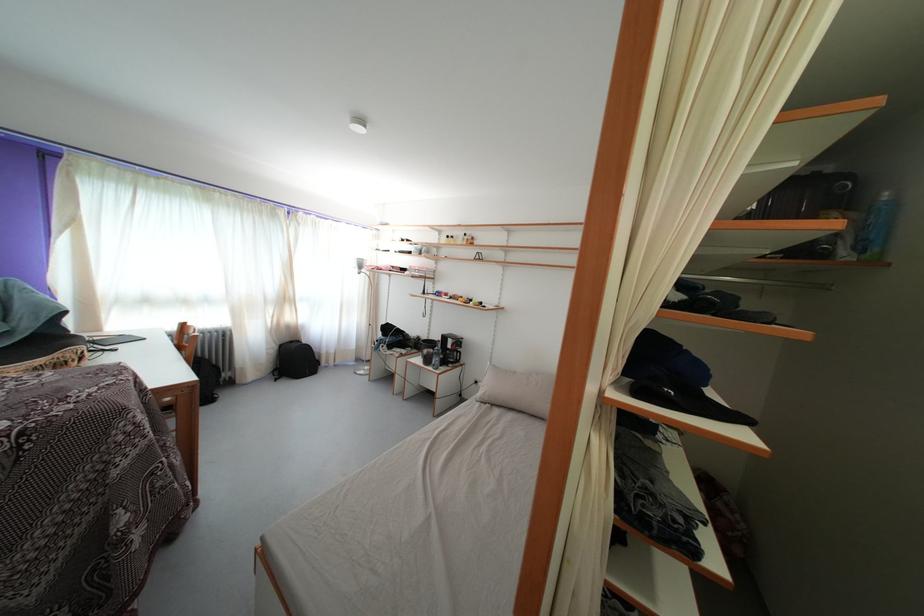
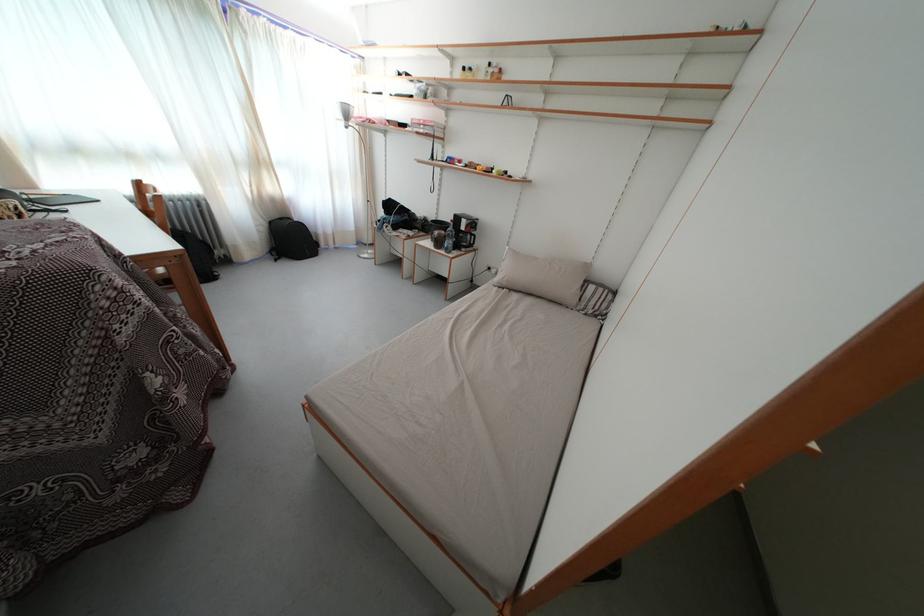
Locate, in the second image, the point that corresponds to point (485, 390) in the first image.

(500, 276)